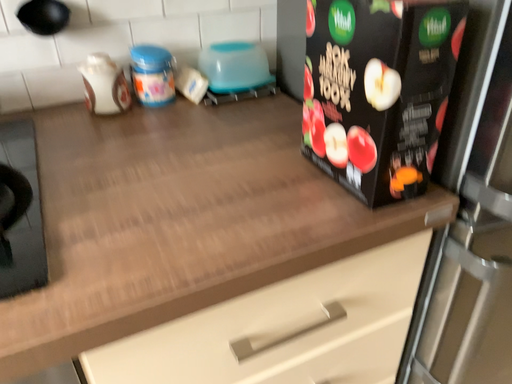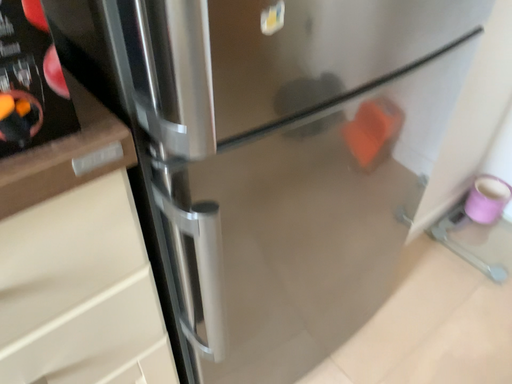
Question: How did the camera likely rotate when shooting the video?

Choices:
 (A) rotated downward
 (B) rotated upward

Answer: (A)